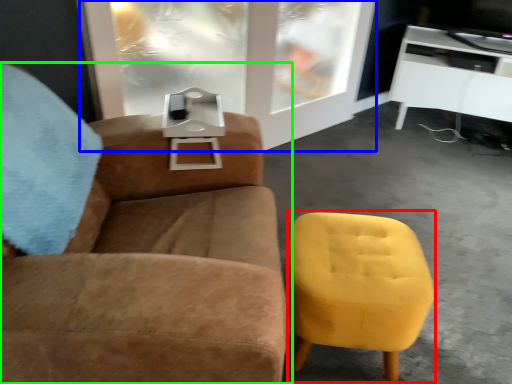
Question: Which is nearer to the swivel chair (highlighted by a red box)? glass door (highlighted by a blue box) or chair (highlighted by a green box).

Choices:
 (A) glass door
 (B) chair

Answer: (B)